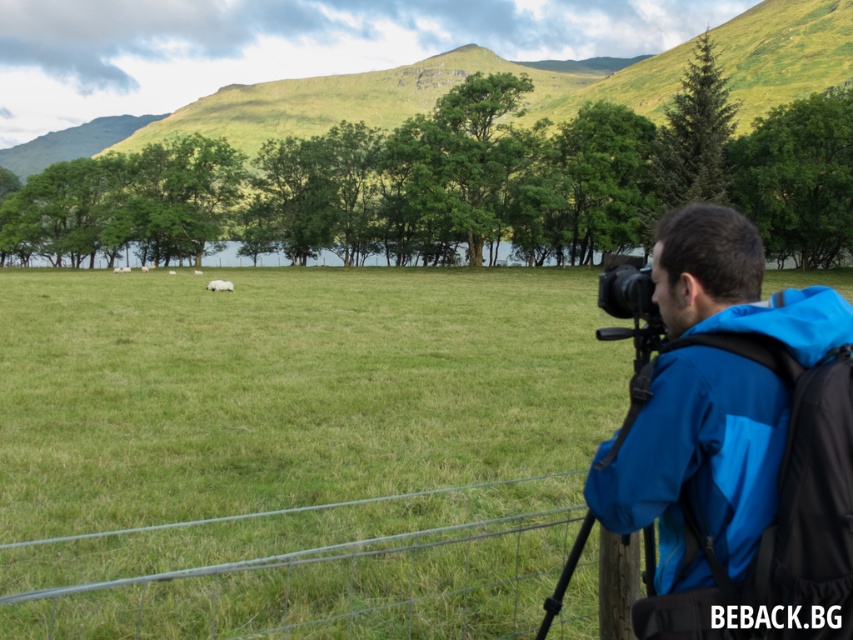
Question: Which object appears closest to the camera in this image?

Choices:
 (A) black plastic camera at right
 (B) black matte tripod at right
 (C) green grassy field at center

Answer: (B)

Question: Which of the following is the closest to the observer?

Choices:
 (A) green grassy field at center
 (B) black plastic camera at right

Answer: (B)

Question: Which is farther from the green grassy field at center?

Choices:
 (A) black plastic camera at right
 (B) black matte tripod at right

Answer: (B)

Question: Does wire mesh fence at lower center lie behind black plastic camera at right?

Choices:
 (A) no
 (B) yes

Answer: (B)

Question: Does blue fabric backpack at right appear over black matte tripod at right?

Choices:
 (A) no
 (B) yes

Answer: (B)

Question: Is the position of wire mesh fence at lower center less distant than that of black matte tripod at right?

Choices:
 (A) no
 (B) yes

Answer: (A)